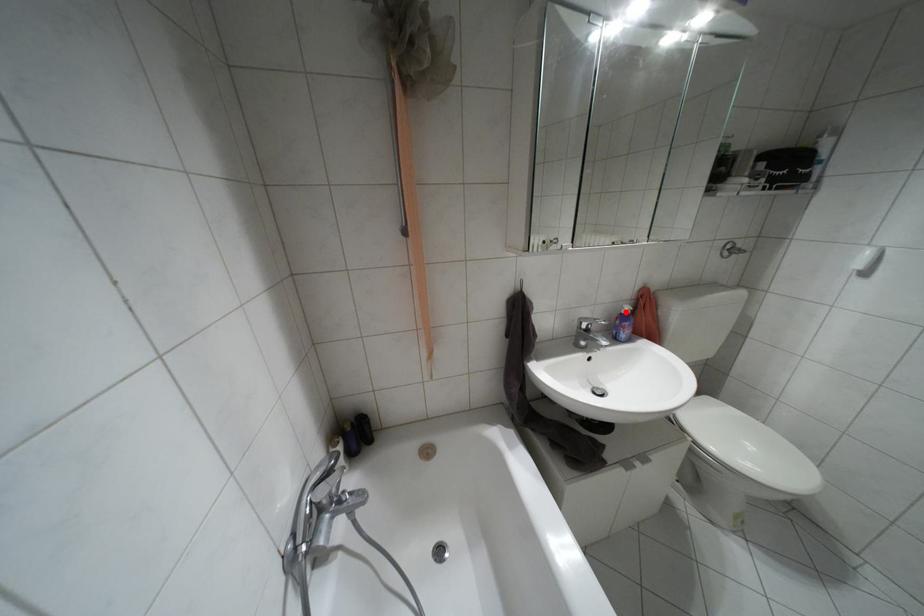
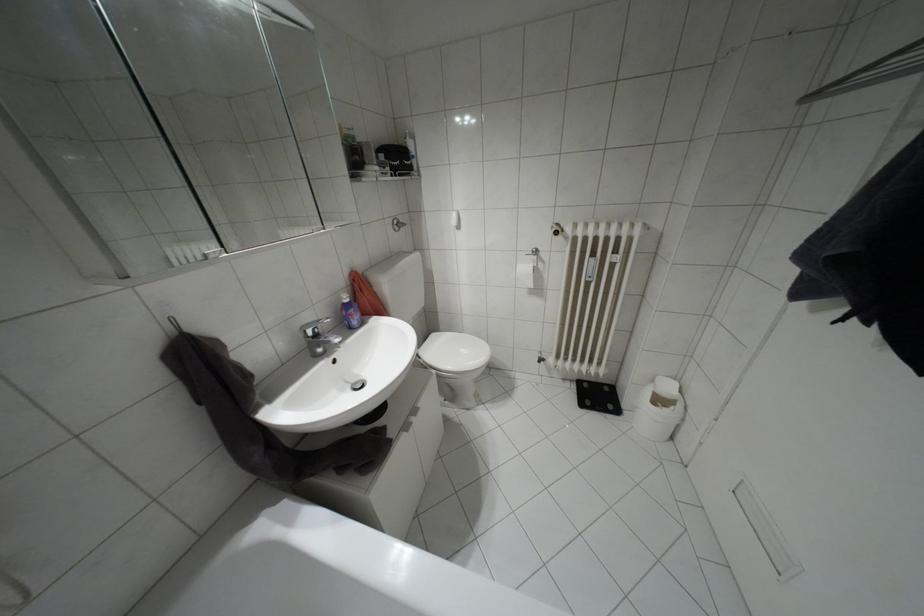
Locate, in the second image, the point that corresponds to the highlighted location in the first image.

(346, 300)